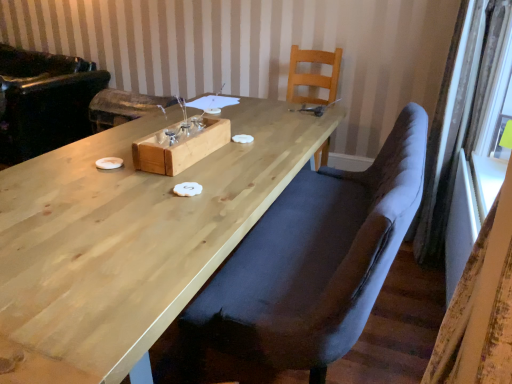
Question: Can you confirm if velvet curtain at right, positioned as the 1th curtain in top-to-bottom order, is taller than natural wood chair at upper center, which is the 2th chair in front-to-back order?

Choices:
 (A) no
 (B) yes

Answer: (B)

Question: Are velvet curtain at right, acting as the 2th curtain starting from the bottom, and natural wood chair at upper center, which is the 2th chair in front-to-back order, located far from each other?

Choices:
 (A) yes
 (B) no

Answer: (A)

Question: Is velvet curtain at right, positioned as the 1th curtain in top-to-bottom order, shorter than natural wood chair at upper center, the 1th chair positioned from the back?

Choices:
 (A) yes
 (B) no

Answer: (B)

Question: From the image's perspective, does velvet curtain at right, positioned as the 1th curtain in top-to-bottom order, appear higher than natural wood chair at upper center, which is the 2th chair in front-to-back order?

Choices:
 (A) no
 (B) yes

Answer: (A)

Question: Considering the relative sizes of velvet curtain at right, acting as the 2th curtain starting from the bottom, and natural wood chair at upper center, the 1th chair positioned from the back, in the image provided, is velvet curtain at right, acting as the 2th curtain starting from the bottom, bigger than natural wood chair at upper center, the 1th chair positioned from the back,?

Choices:
 (A) no
 (B) yes

Answer: (A)

Question: Does velvet curtain at right, positioned as the 1th curtain in top-to-bottom order, have a greater width compared to natural wood chair at upper center, which is the 2th chair in front-to-back order?

Choices:
 (A) no
 (B) yes

Answer: (A)

Question: From a real-world perspective, is velvet dark blue chair at center, the 1th chair positioned from the front, under natural wood tray at center?

Choices:
 (A) yes
 (B) no

Answer: (A)

Question: From a real-world perspective, is velvet dark blue chair at center, the 1th chair positioned from the front, on natural wood tray at center?

Choices:
 (A) no
 (B) yes

Answer: (A)

Question: Can you confirm if velvet dark blue chair at center, the 1th chair positioned from the front, is wider than natural wood tray at center?

Choices:
 (A) yes
 (B) no

Answer: (A)

Question: Could you tell me if velvet dark blue chair at center, the 2th chair in the back-to-front sequence, is facing natural wood tray at center?

Choices:
 (A) no
 (B) yes

Answer: (B)

Question: Does velvet dark blue chair at center, the 1th chair positioned from the front, contain natural wood tray at center?

Choices:
 (A) no
 (B) yes

Answer: (A)

Question: Is velvet dark blue chair at center, the 1th chair positioned from the front, smaller than natural wood tray at center?

Choices:
 (A) no
 (B) yes

Answer: (A)

Question: Does black leather armchair at left have a smaller size compared to velvet dark blue chair at center, the 2th chair in the back-to-front sequence?

Choices:
 (A) no
 (B) yes

Answer: (A)